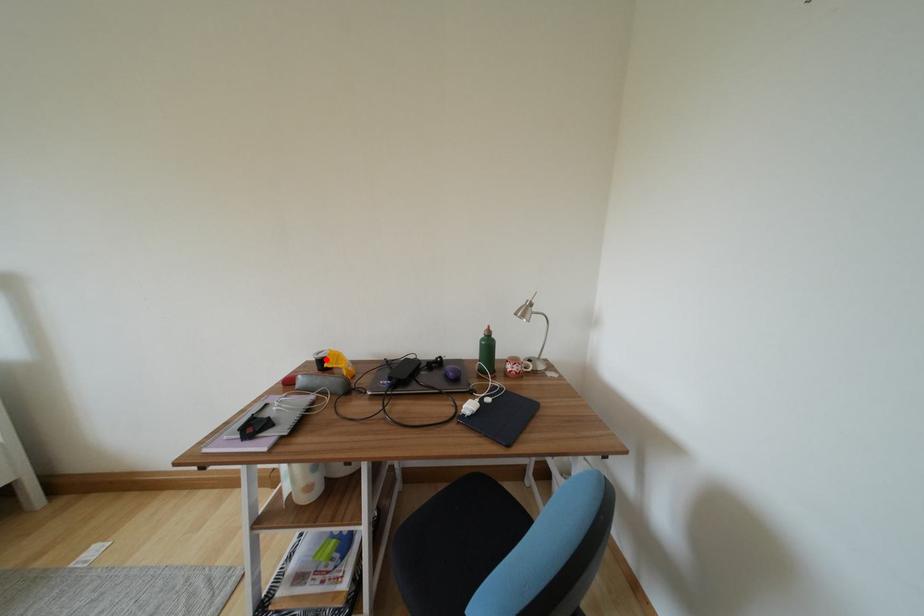
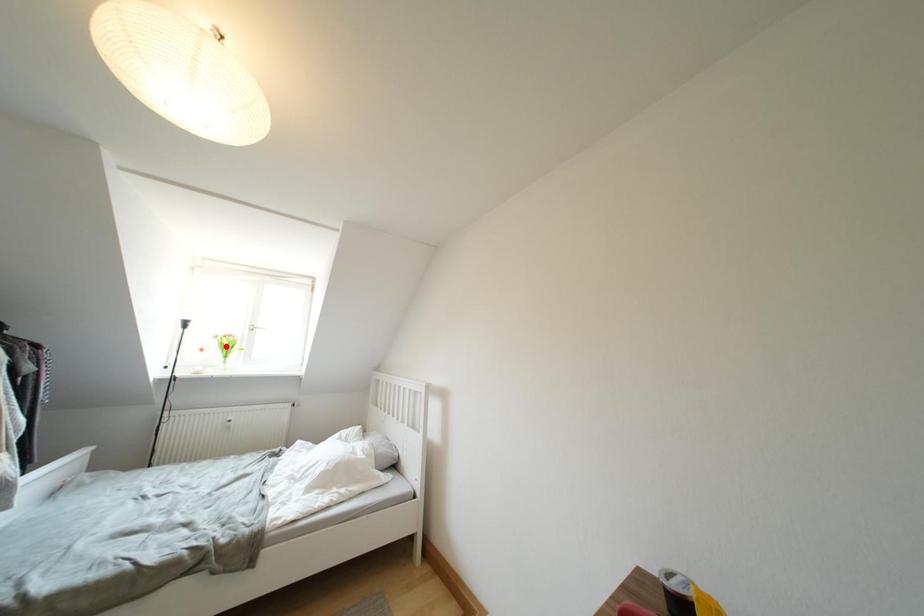
I am providing you with two images of the same scene from different viewpoints. A red point is marked on the first image and another point is marked on the second image. Is the marked point in image1 the same physical position as the marked point in image2?

No